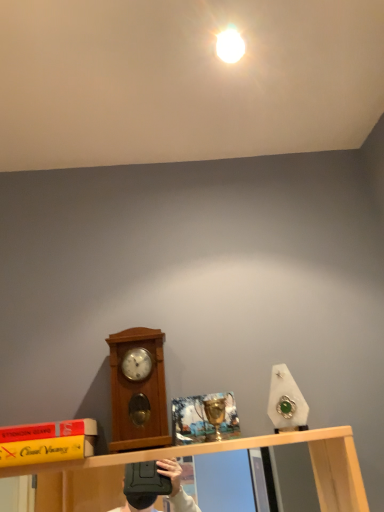
The height and width of the screenshot is (512, 384). What are the coordinates of `free space in front of white glossy light bulb at upper center` in the screenshot? It's located at (234, 18).